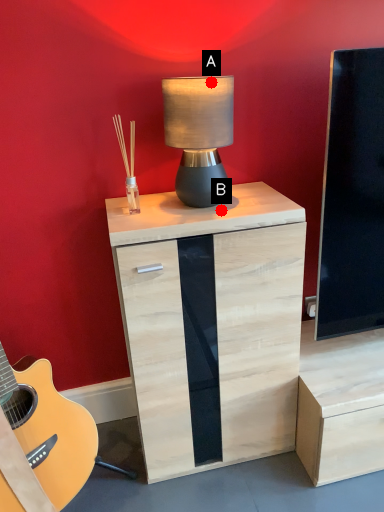
Question: Two points are circled on the image, labeled by A and B beside each circle. Which point is farther from the camera taking this photo?

Choices:
 (A) A is further
 (B) B is further

Answer: (B)